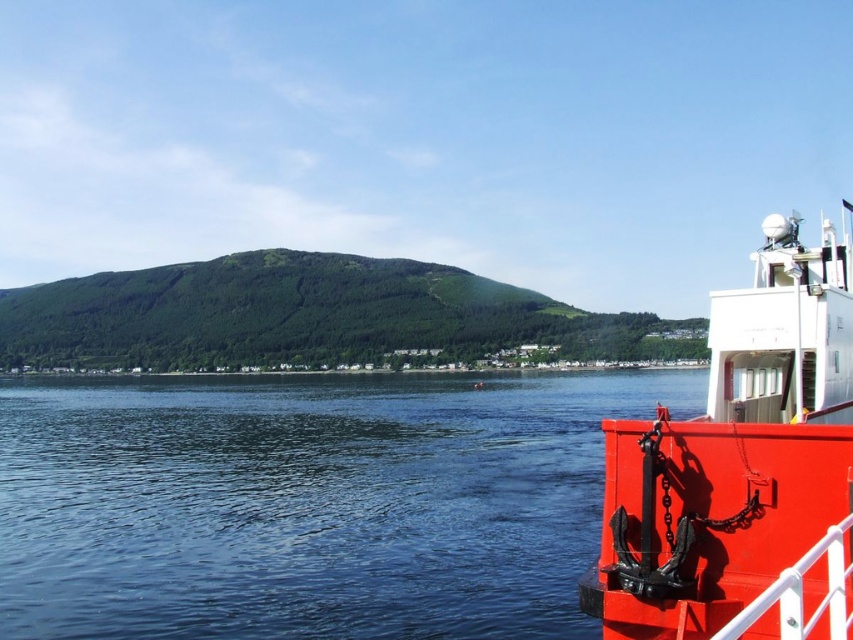
Which is below, metallic red boat at right or green forested hill at center?

Positioned lower is metallic red boat at right.

Identify the location of metallic red boat at right. The image size is (853, 640). (735, 452).

Is clear water at lower right below green forested hill at center?

Correct, clear water at lower right is located below green forested hill at center.

Find the location of a particular element. Image resolution: width=853 pixels, height=640 pixels. clear water at lower right is located at coordinates (308, 502).

Identify the location of clear water at lower right. The width and height of the screenshot is (853, 640). (308, 502).

Can you confirm if clear water at lower right is positioned to the left of metallic red boat at right?

Indeed, clear water at lower right is positioned on the left side of metallic red boat at right.

Looking at this image, is clear water at lower right positioned before metallic red boat at right?

No, it is behind metallic red boat at right.

Is point (164, 509) in front of point (799, 524)?

No.

Locate an element on the screen. This screenshot has height=640, width=853. clear water at lower right is located at coordinates (308, 502).